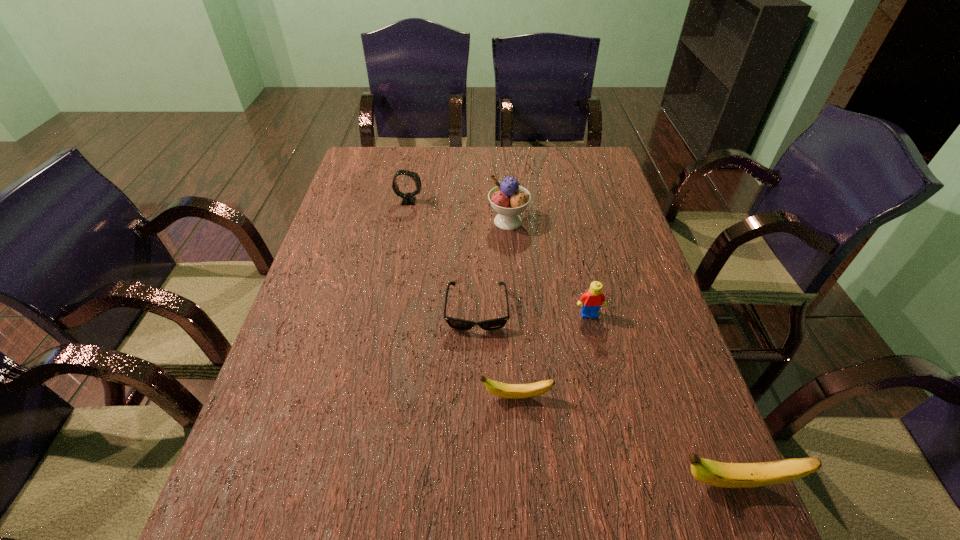
Considering the uniform spacing of bananas, where should an additional banana be positioned on the left? Please locate a free spot. Please provide its 2D coordinates. Your answer should be formatted as a tuple, i.e. [(x, y)], where the tuple contains the x and y coordinates of a point satisfying the conditions above.

[(349, 330)]